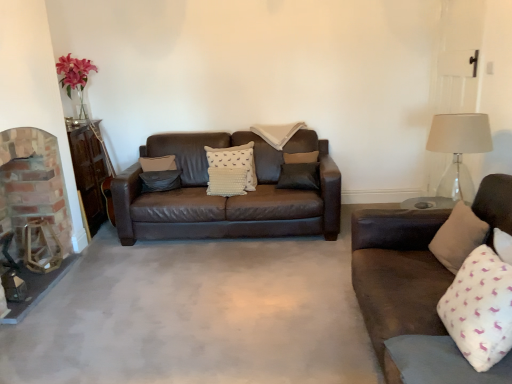
Question: Is beige fabric pillow at center, acting as the 5th pillow starting from the front, smaller than white textured pillow at center, which ranks as the 2th pillow in left-to-right order?

Choices:
 (A) no
 (B) yes

Answer: (A)

Question: Could you tell me if beige fabric pillow at center, acting as the 5th pillow starting from the front, is turned towards white textured pillow at center, the third pillow positioned from the back?

Choices:
 (A) no
 (B) yes

Answer: (A)

Question: From the image's perspective, is beige fabric pillow at center, the first pillow from the back, located beneath white textured pillow at center, which ranks as the 2th pillow in left-to-right order?

Choices:
 (A) yes
 (B) no

Answer: (B)

Question: Would you consider beige fabric pillow at center, the third pillow positioned from the left, to be distant from white textured pillow at center, which ranks as the 2th pillow in left-to-right order?

Choices:
 (A) yes
 (B) no

Answer: (B)

Question: Considering the relative positions of beige fabric pillow at center, acting as the 5th pillow starting from the front, and white textured pillow at center, which ranks as the 2th pillow in left-to-right order, in the image provided, is beige fabric pillow at center, acting as the 5th pillow starting from the front, in front of white textured pillow at center, which ranks as the 2th pillow in left-to-right order,?

Choices:
 (A) yes
 (B) no

Answer: (B)

Question: Considering the positions of point (266, 132) and point (12, 147), is point (266, 132) closer or farther from the camera than point (12, 147)?

Choices:
 (A) farther
 (B) closer

Answer: (A)

Question: Is beige fabric pillow at center, the first pillow from the back, in front of or behind brick fireplace at left in the image?

Choices:
 (A) behind
 (B) front

Answer: (A)

Question: Is beige fabric pillow at center, the first pillow from the back, situated inside brick fireplace at left or outside?

Choices:
 (A) inside
 (B) outside

Answer: (B)

Question: Based on their positions, is beige fabric pillow at center, the first pillow from the back, located to the left or right of brick fireplace at left?

Choices:
 (A) left
 (B) right

Answer: (B)

Question: Considering their positions, is white soft pillow at right, which is counted as the fourth pillow, starting from the left, located in front of or behind brick fireplace at left?

Choices:
 (A) behind
 (B) front

Answer: (B)

Question: Is white soft pillow at right, which appears as the fifth pillow when viewed from the back, taller or shorter than brick fireplace at left?

Choices:
 (A) short
 (B) tall

Answer: (A)

Question: Looking at the image, does white soft pillow at right, the 1th pillow in the front-to-back sequence, seem bigger or smaller compared to brick fireplace at left?

Choices:
 (A) big
 (B) small

Answer: (B)

Question: Considering the positions of point (458, 322) and point (74, 253), is point (458, 322) closer or farther from the camera than point (74, 253)?

Choices:
 (A) farther
 (B) closer

Answer: (B)

Question: Choose the correct answer: Is beige fabric pillow at right, which is the 1th pillow from right to left, inside beige fabric pillow at center, acting as the 5th pillow starting from the front, or outside it?

Choices:
 (A) inside
 (B) outside

Answer: (B)

Question: Based on their positions, is beige fabric pillow at right, the fourth pillow in the back-to-front sequence, located to the left or right of beige fabric pillow at center, acting as the 5th pillow starting from the front?

Choices:
 (A) right
 (B) left

Answer: (A)